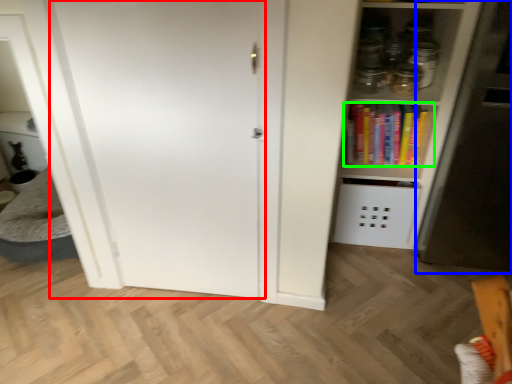
Question: Which is nearer to the door (highlighted by a red box)? fridge (highlighted by a blue box) or book (highlighted by a green box).

Choices:
 (A) fridge
 (B) book

Answer: (B)